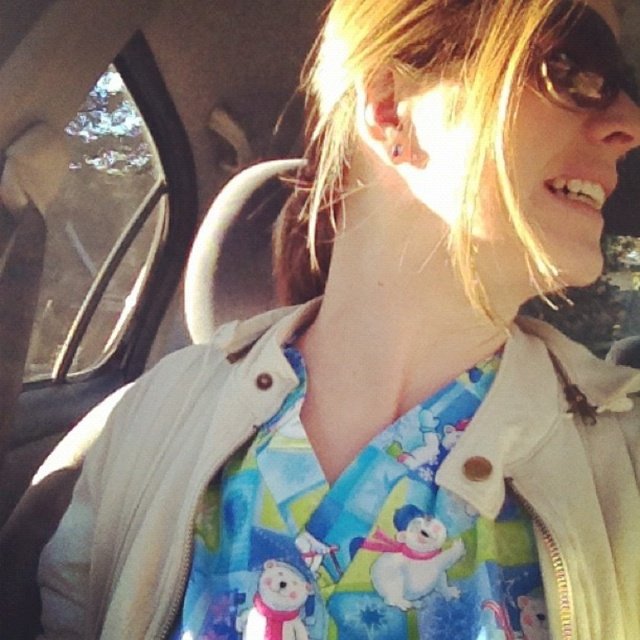
Question: Where is transparent glass car window at left located in relation to transparent plastic goggles at upper right in the image?

Choices:
 (A) above
 (B) below

Answer: (A)

Question: Among these points, which one is nearest to the camera?

Choices:
 (A) (580, 97)
 (B) (154, 186)

Answer: (A)

Question: Among these objects, which one is farthest from the camera?

Choices:
 (A) transparent glass car window at left
 (B) transparent plastic goggles at upper right

Answer: (A)

Question: Among these points, which one is nearest to the camera?

Choices:
 (A) (577, 42)
 (B) (77, 294)

Answer: (A)

Question: Is transparent glass car window at left positioned in front of transparent plastic goggles at upper right?

Choices:
 (A) yes
 (B) no

Answer: (B)

Question: Does transparent glass car window at left have a greater width compared to transparent plastic goggles at upper right?

Choices:
 (A) no
 (B) yes

Answer: (B)